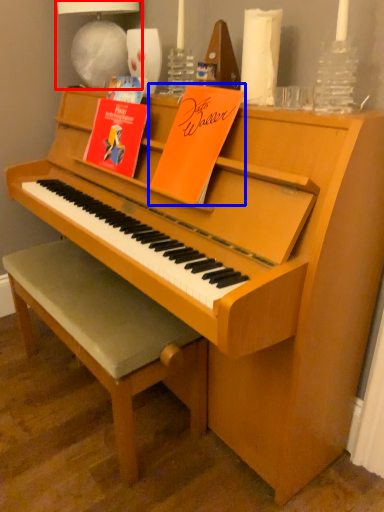
Question: Which object appears closest to the camera in this image, lamp (highlighted by a red box) or paperback book (highlighted by a blue box)?

Choices:
 (A) lamp
 (B) paperback book

Answer: (B)